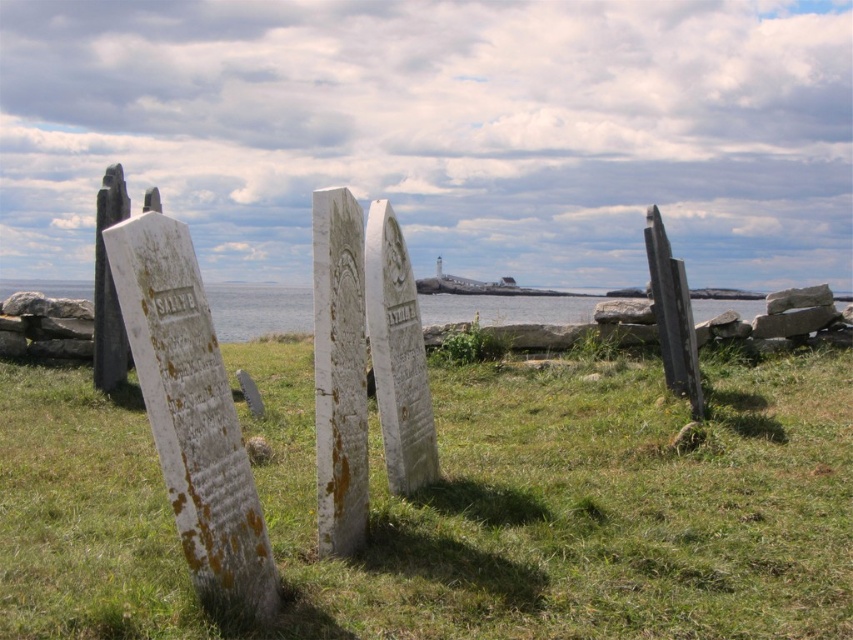
Question: Can you confirm if green grass at center is positioned to the right of clear blue water at center?

Choices:
 (A) no
 (B) yes

Answer: (B)

Question: Which point appears closest to the camera in this image?

Choices:
 (A) (131, 508)
 (B) (473, 316)

Answer: (A)

Question: Is green grass at center positioned behind clear blue water at center?

Choices:
 (A) yes
 (B) no

Answer: (B)

Question: Which point is closer to the camera?

Choices:
 (A) green grass at center
 (B) clear blue water at center

Answer: (A)

Question: Can you confirm if green grass at center is smaller than clear blue water at center?

Choices:
 (A) yes
 (B) no

Answer: (A)

Question: Which of the following is the closest to the observer?

Choices:
 (A) green grass at center
 (B) clear blue water at center

Answer: (A)